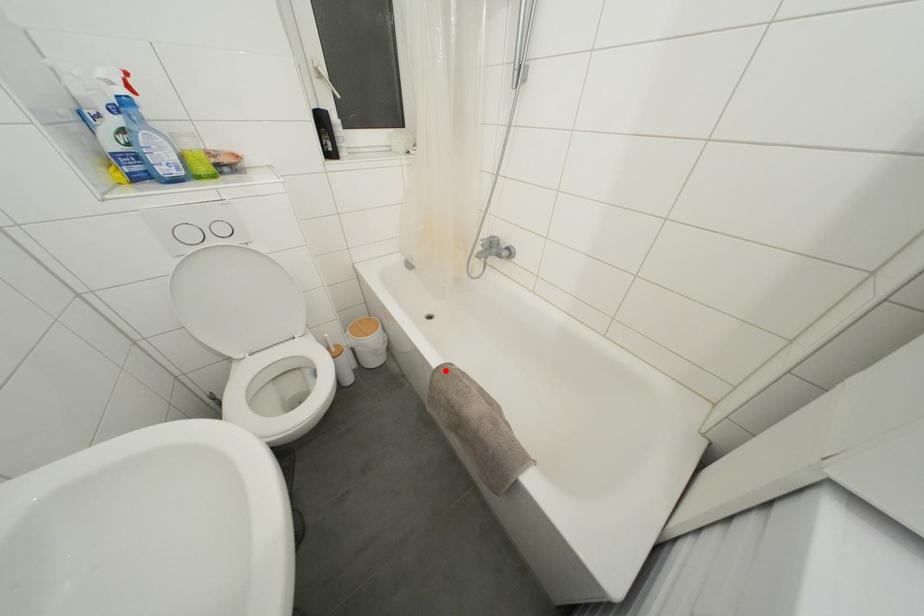
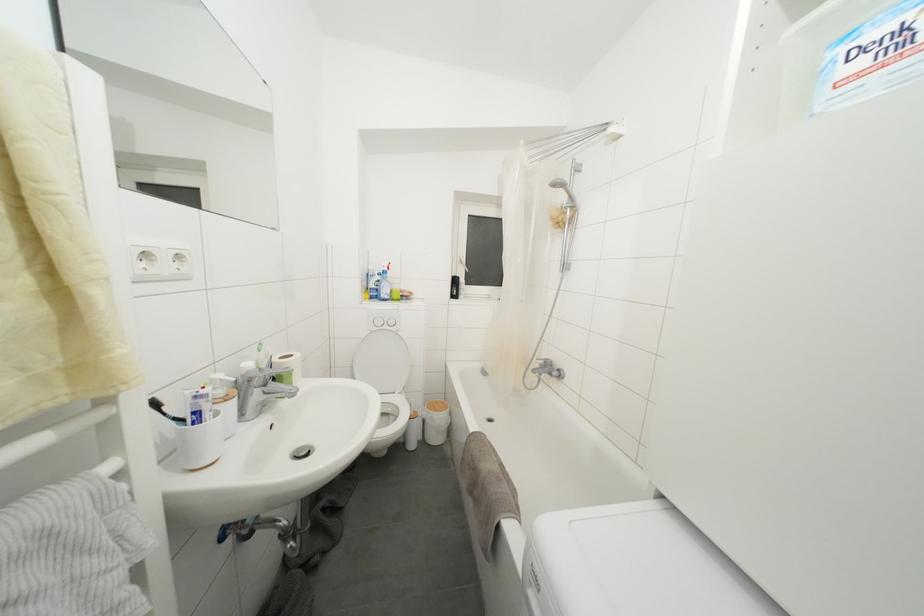
The point at the highlighted location is marked in the first image. Where is the corresponding point in the second image?

(480, 438)